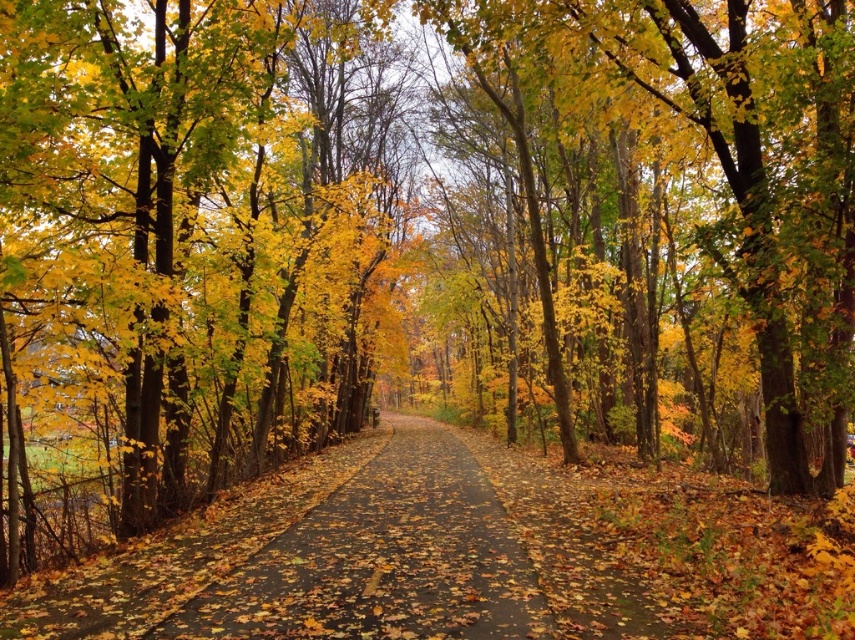
Question: Is yellow-green leaves at center to the left of brown asphalt path at center from the viewer's perspective?

Choices:
 (A) no
 (B) yes

Answer: (A)

Question: Which point is closer to the camera taking this photo?

Choices:
 (A) (502, 611)
 (B) (635, 412)

Answer: (A)

Question: Does yellow-green leaves at center have a lesser width compared to brown asphalt path at center?

Choices:
 (A) no
 (B) yes

Answer: (A)

Question: Is yellow-green leaves at center wider than brown asphalt path at center?

Choices:
 (A) no
 (B) yes

Answer: (B)

Question: Which point is farther to the camera?

Choices:
 (A) yellow-green leaves at center
 (B) brown asphalt path at center

Answer: (A)

Question: Which point appears farthest from the camera in this image?

Choices:
 (A) (846, 140)
 (B) (534, 632)

Answer: (A)